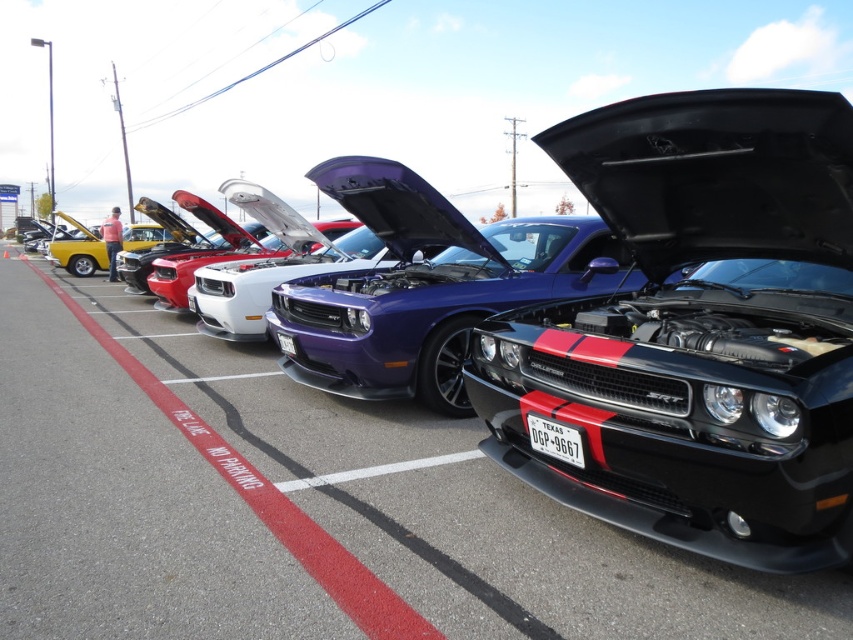
Question: Is red paint at center positioned before metallic yellow car at left?

Choices:
 (A) no
 (B) yes

Answer: (B)

Question: Is the position of shiny purple car at center more distant than that of red paint at center?

Choices:
 (A) yes
 (B) no

Answer: (A)

Question: Which point is farther from the camera taking this photo?

Choices:
 (A) (343, 173)
 (B) (782, 92)
 (C) (166, 408)

Answer: (A)

Question: Considering the real-world distances, which object is farthest from the shiny purple car at center?

Choices:
 (A) black matte car at center
 (B) red paint at center

Answer: (B)

Question: Can you confirm if shiny purple car at center is bigger than red paint at center?

Choices:
 (A) yes
 (B) no

Answer: (B)

Question: Which object is positioned farthest from the metallic yellow car at left?

Choices:
 (A) black matte car at center
 (B) red paint at center
 (C) shiny purple car at center

Answer: (A)